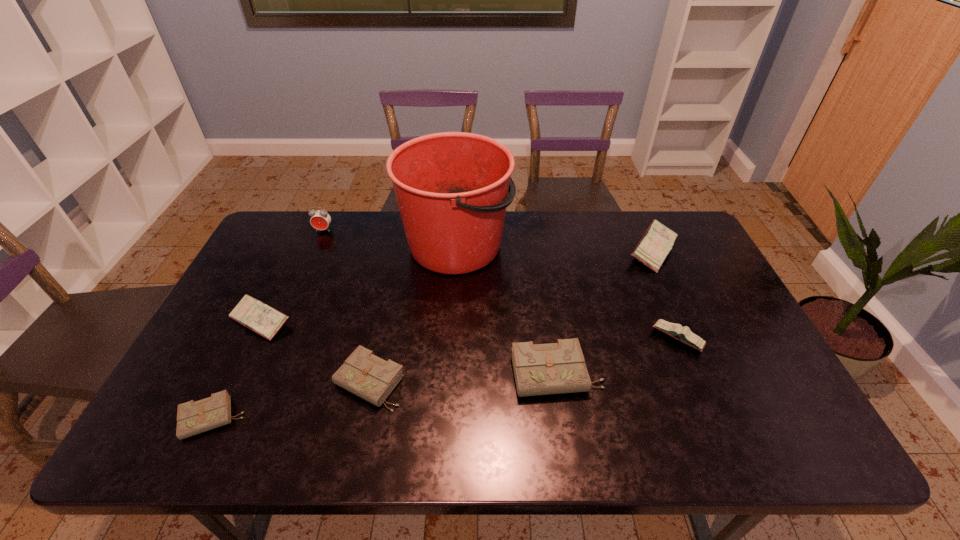
The width and height of the screenshot is (960, 540). In order to click on vacant space positioned 0.240m on the front of the smallest pink diary in this screenshot , I will do `click(724, 447)`.

Where is `blank space located on the right of the smallest green diary`? The width and height of the screenshot is (960, 540). blank space located on the right of the smallest green diary is located at coordinates (336, 418).

Find the location of a particular element. bucket positioned at the far edge is located at coordinates (452, 188).

Find the location of a particular element. This screenshot has height=540, width=960. alarm clock that is at the far edge is located at coordinates (320, 219).

Where is `diary at the far edge`? The height and width of the screenshot is (540, 960). diary at the far edge is located at coordinates (652, 249).

You are a GUI agent. You are given a task and a screenshot of the screen. Output one action in this format:
    pyautogui.click(x=<x>, y=<y>)
    Task: Click on the object positioned at the near edge
    
    Given the screenshot: What is the action you would take?
    pyautogui.click(x=194, y=417)

This screenshot has width=960, height=540. Find the location of `alarm clock that is at the left edge`. alarm clock that is at the left edge is located at coordinates click(x=320, y=219).

In order to click on object that is at the far left corner in this screenshot , I will do `click(320, 219)`.

Where is `object that is at the near left corner`? object that is at the near left corner is located at coordinates (194, 417).

Image resolution: width=960 pixels, height=540 pixels. Identify the location of object located in the far right corner section of the desktop. pos(652,249).